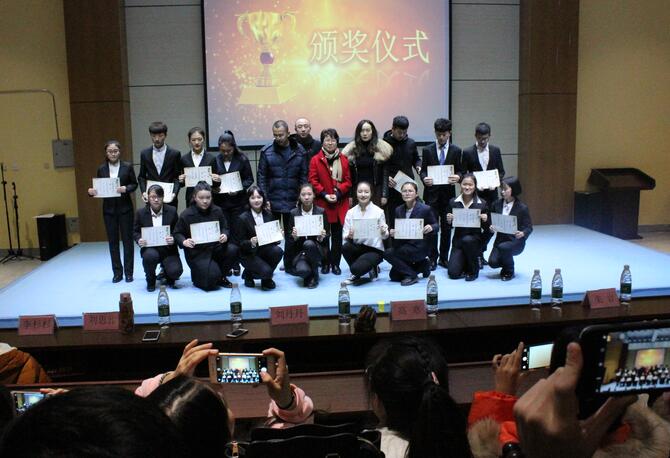
You are a GUI agent. You are given a task and a screenshot of the screen. Output one action in this format:
    pyautogui.click(x=<x>, y=<y>)
    Task: Click on the bottle
    
    Given the screenshot: What is the action you would take?
    pyautogui.click(x=165, y=310), pyautogui.click(x=129, y=312), pyautogui.click(x=238, y=305), pyautogui.click(x=340, y=308), pyautogui.click(x=433, y=291), pyautogui.click(x=535, y=284), pyautogui.click(x=555, y=284), pyautogui.click(x=626, y=281)